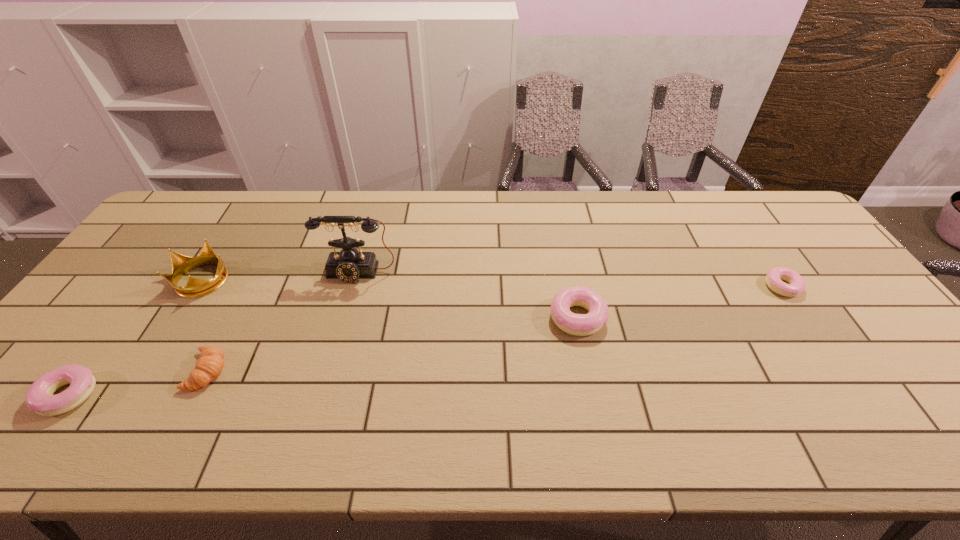
Identify the location of free space for an extra doughnut to achieve even spacing. click(x=342, y=354).